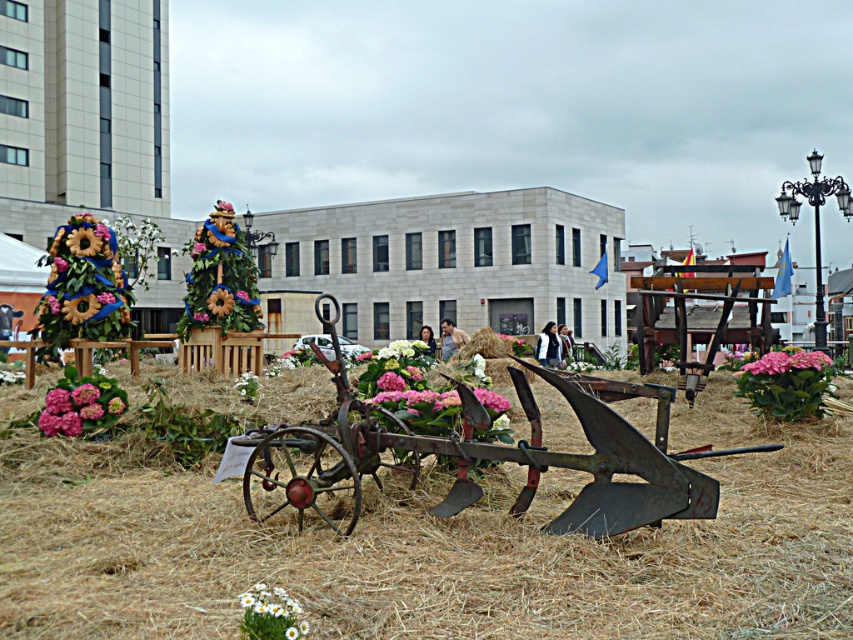
Question: Which object is farther from the camera taking this photo?

Choices:
 (A) brown straw at center
 (B) pink matte hydrangea at center right

Answer: (B)

Question: Does rusty metal wagon at center appear on the left side of pink matte hydrangea at lower left?

Choices:
 (A) no
 (B) yes

Answer: (A)

Question: Does pink matte hydrangea at lower left come in front of pink matte hydrangea at center right?

Choices:
 (A) no
 (B) yes

Answer: (B)

Question: Based on their relative distances, which object is farther from the pink matte hydrangea at lower left?

Choices:
 (A) brown straw at center
 (B) rusty metal wagon at center

Answer: (B)

Question: Does brown straw at center appear on the right side of pink matte hydrangea at center right?

Choices:
 (A) yes
 (B) no

Answer: (B)

Question: Which object appears closest to the camera in this image?

Choices:
 (A) pink matte hydrangea at lower left
 (B) brown straw at center

Answer: (B)